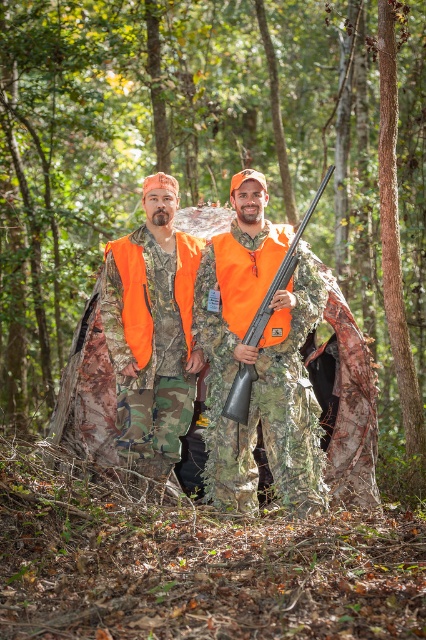
You are a hunter preparing to carry your equipment through the dense woodland. You have the camouflage fabric hunting gear at center and the matte orange shotgun at center. Which item should you carry first if you need to prioritize the larger one?

The camouflage fabric hunting gear at center is larger in size than the matte orange shotgun at center, so you should carry the camouflage fabric hunting gear at center first.

You are a photographer trying to capture the hunters in the forest. You have a camera that can focus on subjects within 5 meters. Are the camouflage fabric hunting gear at center within your camera range?

The camouflage fabric hunting gear at center and camera are 6.83 meters apart, which is beyond the camera range of 5 meters. Therefore, the camouflage fabric hunting gear at center is out of focus.

Based on the photo, you are a hiker who has spotted two items at the center of the forest. You see the camouflage fabric hunting gear at center and the matte orange shotgun at center. Which item is taller?

The camouflage fabric hunting gear at center is taller than the matte orange shotgun at center.